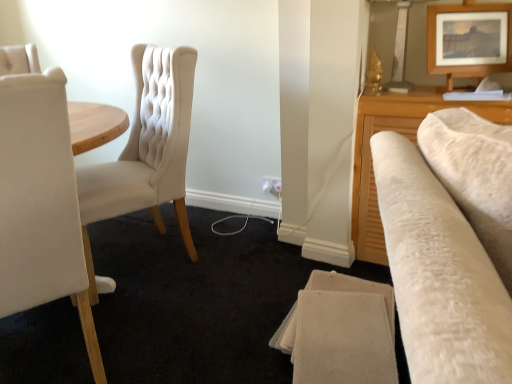
Question: Which direction should I rotate to look at white plastic electric outlet at lower center?

Choices:
 (A) left
 (B) right

Answer: (B)

Question: From a real-world perspective, is matte cream fabric chair at left, the 2th chair when ordered from front to back, on wooden picture frame at upper right?

Choices:
 (A) no
 (B) yes

Answer: (A)

Question: Is there a large distance between matte cream fabric chair at left, the 1th chair from the back, and wooden picture frame at upper right?

Choices:
 (A) no
 (B) yes

Answer: (B)

Question: Does matte cream fabric chair at left, the 1th chair from the back, have a lesser height compared to wooden picture frame at upper right?

Choices:
 (A) no
 (B) yes

Answer: (A)

Question: Does matte cream fabric chair at left, the 1th chair from the back, have a greater width compared to wooden picture frame at upper right?

Choices:
 (A) yes
 (B) no

Answer: (A)

Question: Is matte cream fabric chair at left, the 1th chair from the back, aimed at wooden picture frame at upper right?

Choices:
 (A) yes
 (B) no

Answer: (B)

Question: Can you confirm if matte cream fabric chair at left, the 1th chair from the back, is positioned to the right of wooden picture frame at upper right?

Choices:
 (A) yes
 (B) no

Answer: (B)

Question: From the image's perspective, is white plastic electric outlet at lower center on matte cream fabric chair at left, the 1th chair from the back?

Choices:
 (A) yes
 (B) no

Answer: (B)

Question: Considering the relative sizes of white plastic electric outlet at lower center and matte cream fabric chair at left, the 2th chair when ordered from front to back, in the image provided, is white plastic electric outlet at lower center taller than matte cream fabric chair at left, the 2th chair when ordered from front to back,?

Choices:
 (A) no
 (B) yes

Answer: (A)

Question: Is matte cream fabric chair at left, the 1th chair from the back, surrounded by white plastic electric outlet at lower center?

Choices:
 (A) no
 (B) yes

Answer: (A)

Question: From a real-world perspective, is white plastic electric outlet at lower center positioned under matte cream fabric chair at left, the 1th chair from the back, based on gravity?

Choices:
 (A) yes
 (B) no

Answer: (A)

Question: Is white plastic electric outlet at lower center positioned before matte cream fabric chair at left, the 1th chair from the back?

Choices:
 (A) no
 (B) yes

Answer: (A)

Question: Is there a large distance between white plastic electric outlet at lower center and matte cream fabric chair at left, the 1th chair from the back?

Choices:
 (A) yes
 (B) no

Answer: (B)

Question: Is white plastic electric outlet at lower center far from wooden picture frame at upper right?

Choices:
 (A) yes
 (B) no

Answer: (A)